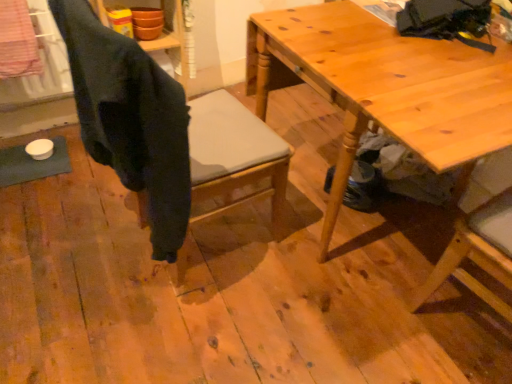
Locate an element on the screen. free region under wooden table at center (from a real-world perspective) is located at coordinates (366, 229).